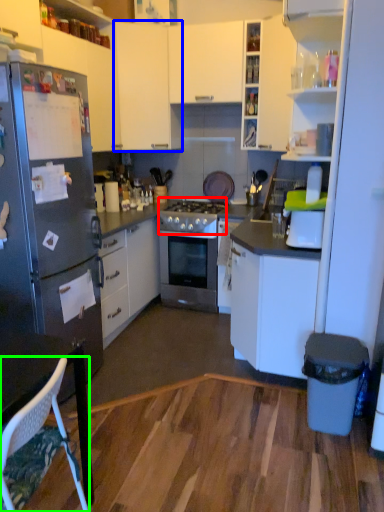
Question: Estimate the real-world distances between objects in this image. Which object is farther from gas stove (highlighted by a red box), cabinetry (highlighted by a blue box) or chair (highlighted by a green box)?

Choices:
 (A) cabinetry
 (B) chair

Answer: (B)